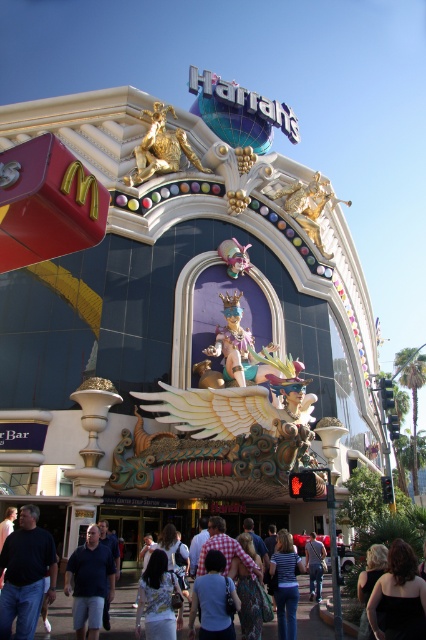
Consider the image. You are standing at the entrance of Harrah Casino and want to find the black satin dress at lower right. According to the coordinates provided, where should you look relative to the entrance?

The black satin dress at lower right is located at coordinates point (x=399, y=596), which is near the bottom right corner of the image. Since you are at the entrance, you should look towards the lower right direction to find it.

You are attending an event at Harrah Casino and need to find a place to sit. You see a black satin dress at lower right and a dark blue shirt at center. Which clothing item is smaller in size?

The black satin dress at lower right occupies less space than the dark blue shirt at center, so the black satin dress at lower right is smaller in size.